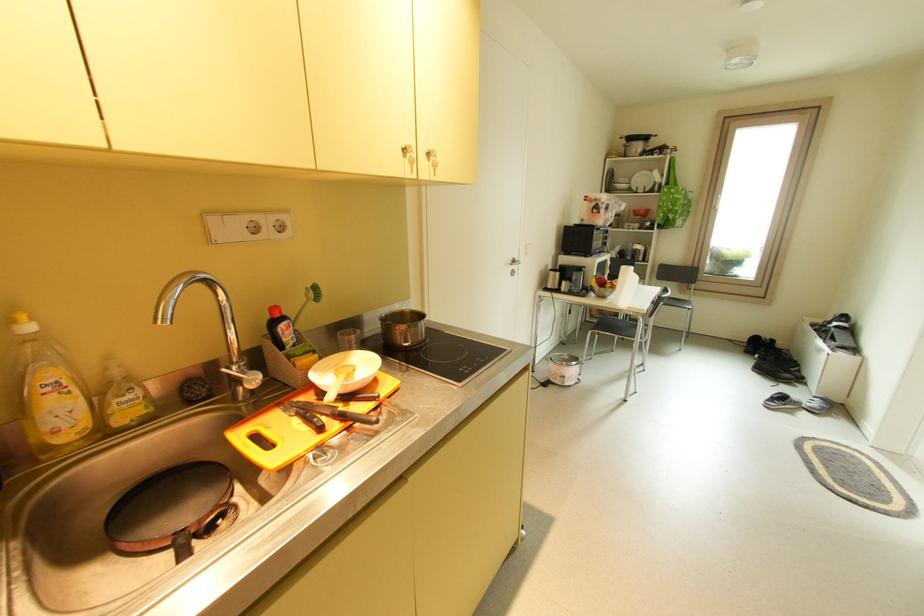
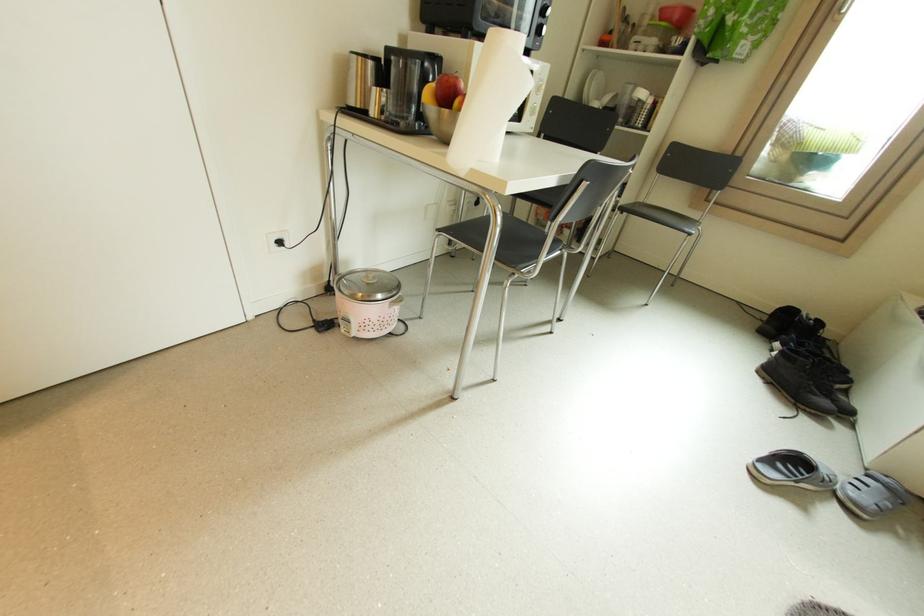
Where in the second image is the point corresponding to point (815, 406) from the first image?

(858, 495)